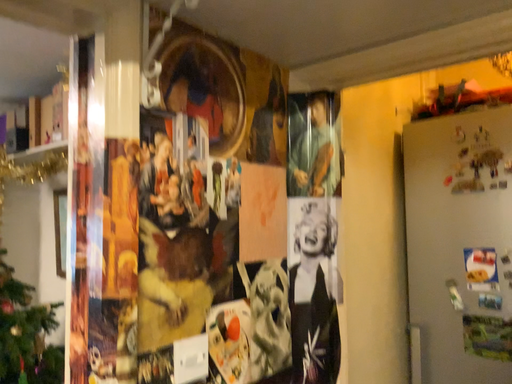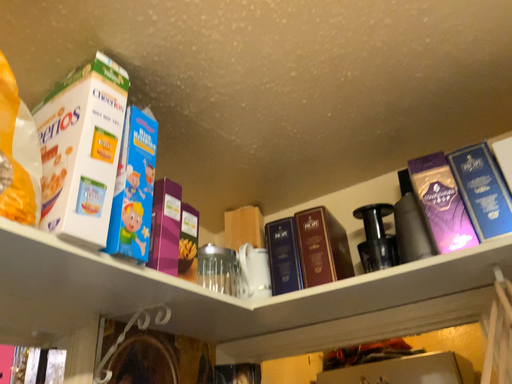
Question: How did the camera likely rotate when shooting the video?

Choices:
 (A) rotated upward
 (B) rotated downward

Answer: (A)